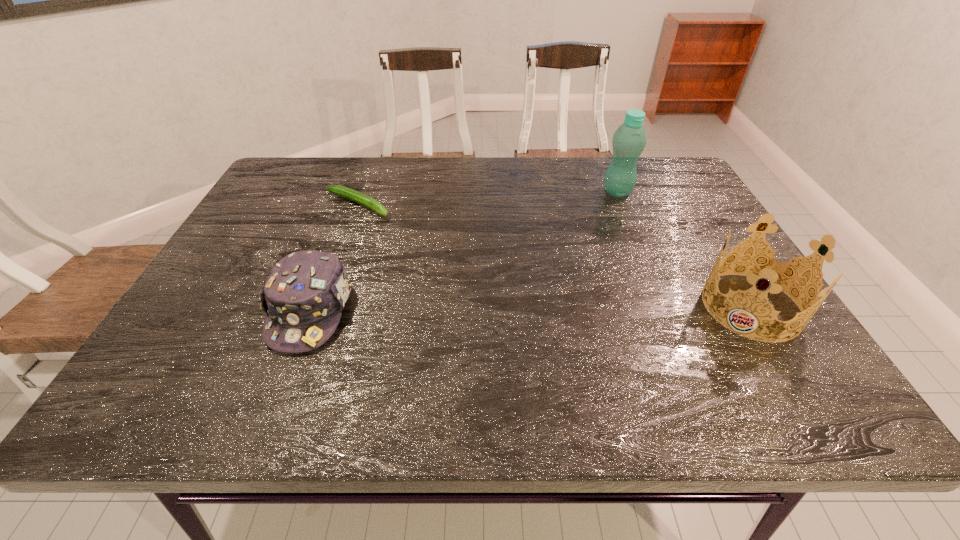
Where is `headwear`? This screenshot has width=960, height=540. headwear is located at coordinates (304, 295).

You are a GUI agent. You are given a task and a screenshot of the screen. Output one action in this format:
    pyautogui.click(x=<x>, y=<y>)
    Task: Click on the rightmost object
    The image size is (960, 540).
    Given the screenshot: What is the action you would take?
    pyautogui.click(x=773, y=272)

Identify the location of the second tallest object. Image resolution: width=960 pixels, height=540 pixels. (773, 272).

The height and width of the screenshot is (540, 960). Find the location of `water bottle`. water bottle is located at coordinates (629, 140).

Locate an element on the screen. The image size is (960, 540). the third object from left to right is located at coordinates (629, 140).

The image size is (960, 540). Identify the location of the shortest object. (350, 194).

The image size is (960, 540). Find the location of `free spot located on the back of the crown`. free spot located on the back of the crown is located at coordinates (715, 248).

Locate an element on the screen. The image size is (960, 540). vacant point located 0.090m at the front cap of the water bottle is located at coordinates (603, 214).

This screenshot has height=540, width=960. Find the location of `free region located 0.150m at the front cap of the water bottle`. free region located 0.150m at the front cap of the water bottle is located at coordinates (595, 225).

Find the location of `free space located at the front cap of the water bottle`. free space located at the front cap of the water bottle is located at coordinates (575, 256).